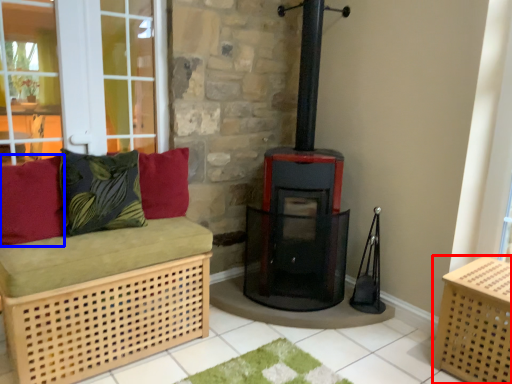
Question: Which point is further to the camera, crate (highlighted by a red box) or pillow (highlighted by a blue box)?

Choices:
 (A) crate
 (B) pillow

Answer: (B)